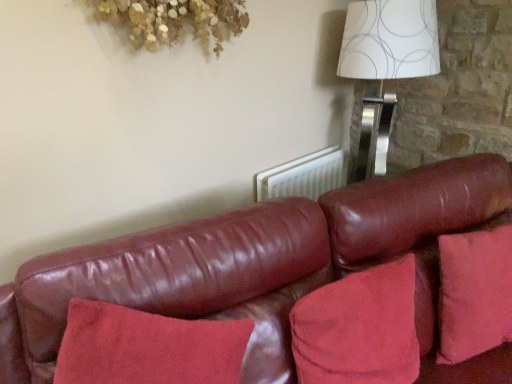
Question: Is suede-like red pillow at lower right next to white paper with silver circles at upper right and touching it?

Choices:
 (A) yes
 (B) no

Answer: (B)

Question: Does suede-like red pillow at lower right appear on the right side of white paper with silver circles at upper right?

Choices:
 (A) yes
 (B) no

Answer: (B)

Question: From a real-world perspective, is suede-like red pillow at lower right below white paper with silver circles at upper right?

Choices:
 (A) yes
 (B) no

Answer: (A)

Question: Is suede-like red pillow at lower right not close to white paper with silver circles at upper right?

Choices:
 (A) yes
 (B) no

Answer: (A)

Question: Does suede-like red pillow at lower right come in front of white paper with silver circles at upper right?

Choices:
 (A) no
 (B) yes

Answer: (B)

Question: Considering the relative sizes of suede-like red pillow at lower right and white paper with silver circles at upper right in the image provided, is suede-like red pillow at lower right wider than white paper with silver circles at upper right?

Choices:
 (A) no
 (B) yes

Answer: (A)

Question: From a real-world perspective, is white paper with silver circles at upper right over suede-like red pillow at lower right?

Choices:
 (A) yes
 (B) no

Answer: (A)

Question: Considering the relative sizes of white paper with silver circles at upper right and suede-like red pillow at lower right in the image provided, is white paper with silver circles at upper right bigger than suede-like red pillow at lower right?

Choices:
 (A) yes
 (B) no

Answer: (A)

Question: Is white paper with silver circles at upper right at the right side of suede-like red pillow at lower right?

Choices:
 (A) no
 (B) yes

Answer: (B)

Question: Is white paper with silver circles at upper right not within suede-like red pillow at lower right?

Choices:
 (A) yes
 (B) no

Answer: (A)

Question: Does white paper with silver circles at upper right have a lesser width compared to suede-like red pillow at lower right?

Choices:
 (A) yes
 (B) no

Answer: (B)

Question: From a real-world perspective, is white paper with silver circles at upper right beneath suede-like red pillow at lower right?

Choices:
 (A) no
 (B) yes

Answer: (A)

Question: Is leather couch at center smaller than suede-like red pillow at lower right?

Choices:
 (A) yes
 (B) no

Answer: (B)